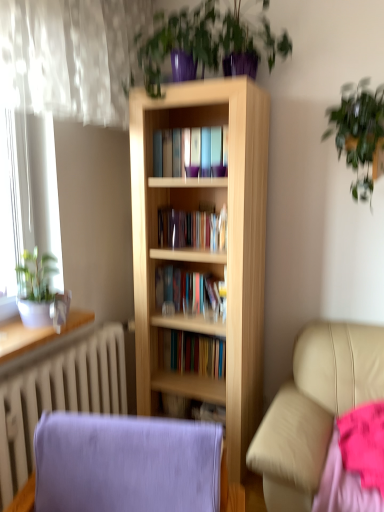
At what (x,y) coordinates should I click in order to perform the action: click on free location above white matte radiator at lower left (from a real-world perspective). Please return your answer as a coordinate pair (x, y). Looking at the image, I should click on (89, 337).